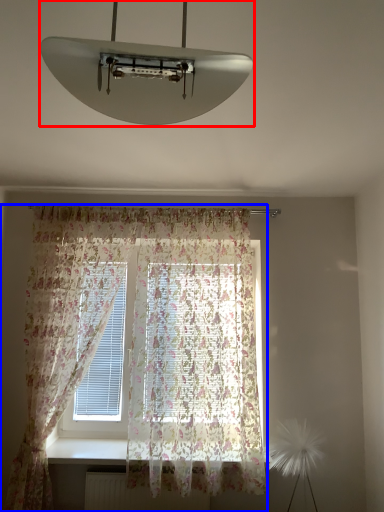
Question: Which object appears farthest to the camera in this image, lamp (highlighted by a red box) or curtain (highlighted by a blue box)?

Choices:
 (A) lamp
 (B) curtain

Answer: (B)